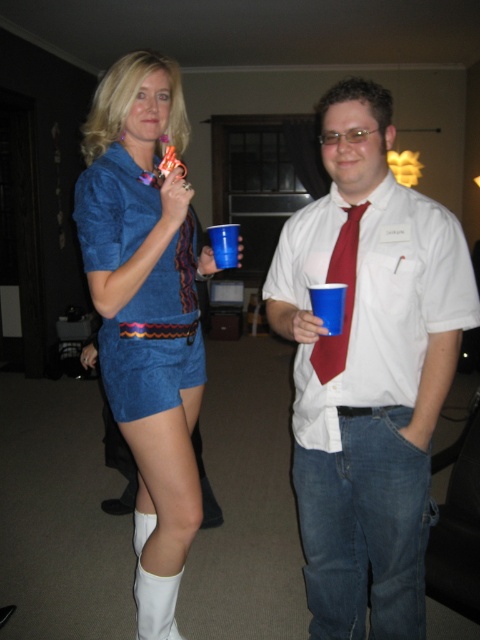
Question: Which of these objects is positioned farthest from the white cotton shirt at center?

Choices:
 (A) matte blue dress at center
 (B) matte red tie at center

Answer: (A)

Question: Is white cotton shirt at center to the right of matte red tie at center from the viewer's perspective?

Choices:
 (A) no
 (B) yes

Answer: (B)

Question: Does white cotton shirt at center appear over matte red tie at center?

Choices:
 (A) yes
 (B) no

Answer: (B)

Question: Can you confirm if white cotton shirt at center is positioned to the right of matte blue dress at center?

Choices:
 (A) no
 (B) yes

Answer: (B)

Question: Which of the following is the farthest from the observer?

Choices:
 (A) (97, 161)
 (B) (347, 500)
 (C) (355, 221)

Answer: (A)

Question: Which object is farther from the camera taking this photo?

Choices:
 (A) matte red tie at center
 (B) white cotton shirt at center

Answer: (A)